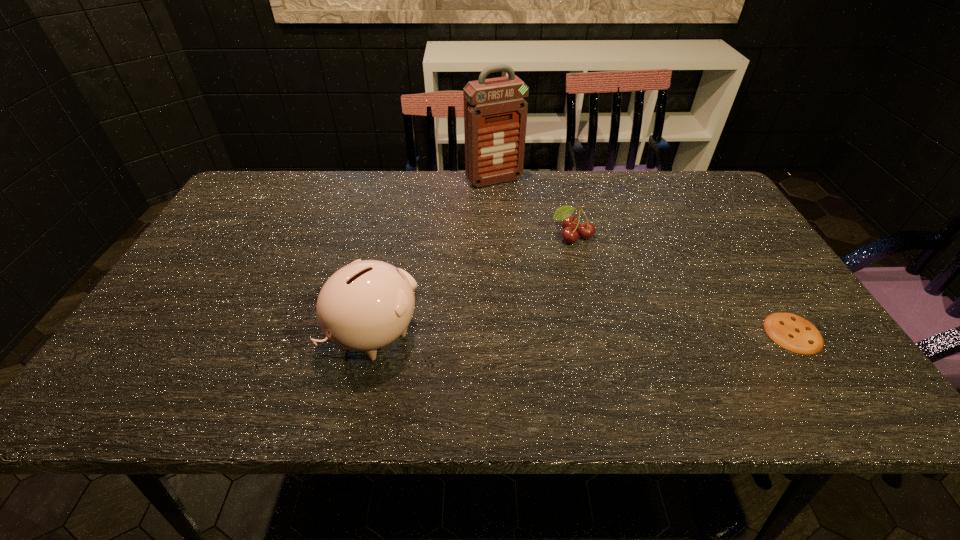
Where is `the leftmost object`? Image resolution: width=960 pixels, height=540 pixels. the leftmost object is located at coordinates (366, 305).

Where is `the third shortest object`? The height and width of the screenshot is (540, 960). the third shortest object is located at coordinates (366, 305).

The height and width of the screenshot is (540, 960). Identify the location of the shortest object. (792, 332).

This screenshot has width=960, height=540. In order to click on cookie in this screenshot , I will do `click(792, 332)`.

Identify the location of the second object from right to left. (585, 230).

Locate an element on the screen. cherry is located at coordinates (585, 230).

Where is `the first-aid kit`? This screenshot has width=960, height=540. the first-aid kit is located at coordinates (495, 112).

Identify the location of the third object from right to left. The image size is (960, 540). (495, 112).

This screenshot has width=960, height=540. In order to click on blank space located 0.110m on the left of the piggy bank in this screenshot , I will do `click(281, 333)`.

Locate an element on the screen. This screenshot has height=540, width=960. free spot located 0.350m on the left of the shortest object is located at coordinates (609, 333).